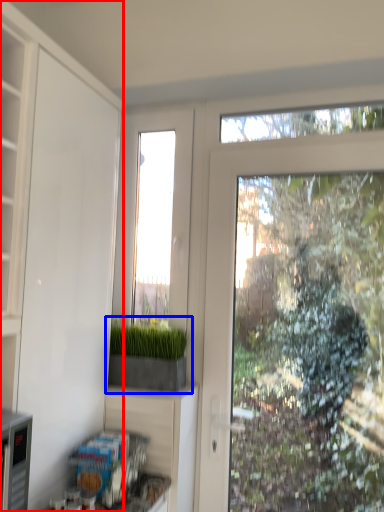
Question: Which object appears farthest to the camera in this image, cabinetry (highlighted by a red box) or houseplant (highlighted by a blue box)?

Choices:
 (A) cabinetry
 (B) houseplant

Answer: (B)